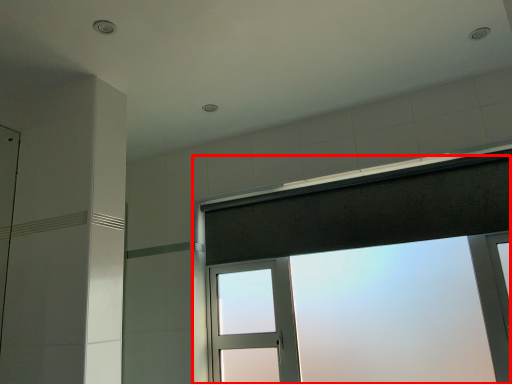
Question: Where is window (annotated by the red box) located in relation to shower curtain in the image?

Choices:
 (A) right
 (B) left

Answer: (A)